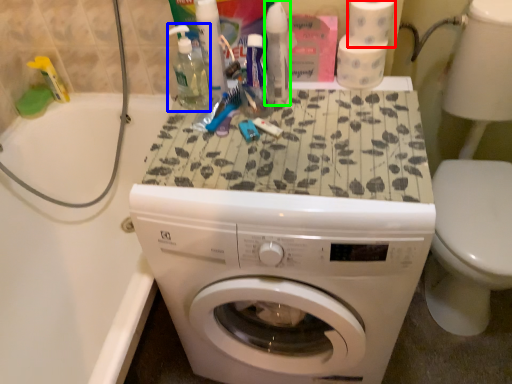
Question: Considering the real-world distances, which object is closest to toilet paper (highlighted by a red box)? cleaning product (highlighted by a blue box) or cleaning product (highlighted by a green box).

Choices:
 (A) cleaning product
 (B) cleaning product

Answer: (B)